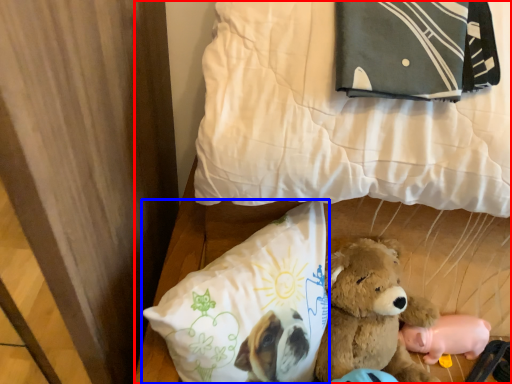
Question: Among these objects, which one is nearest to the camera, bed (highlighted by a red box) or pillow (highlighted by a blue box)?

Choices:
 (A) bed
 (B) pillow

Answer: (A)